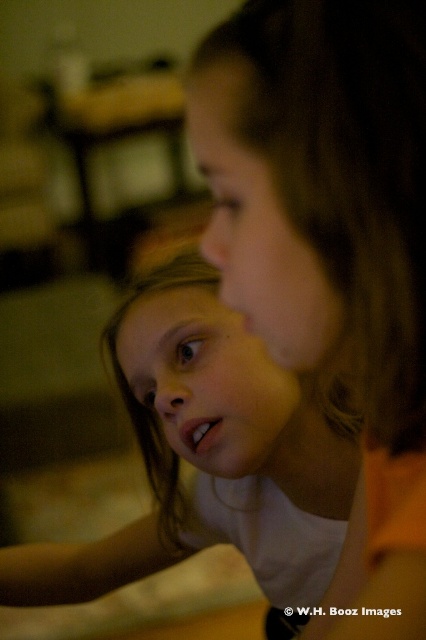
You are a photographer who wants to adjust the focus to capture the matte orange shirt at center clearly. What are the coordinates where you should focus your camera?

The coordinates to focus on are at point [331,250] to capture the matte orange shirt at center clearly.

You are a photographer who wants to ensure both the matte orange shirt at center and the smooth white shirt at center are clearly visible in the photo. Since the background is out of focus, which shirt should you adjust the camera focus on to ensure both shirts are in focus?

The matte orange shirt at center has a smaller size compared to smooth white shirt at center, so you should focus on the matte orange shirt at center to ensure both shirts are in focus.

You are a photographer trying to capture a close shot of two children talking. You have a camera with a 5 inch wide lens. Can you fit both the matte orange shirt at center and the smooth white shirt at center into your frame without moving the camera?

The matte orange shirt at center and smooth white shirt at center are 8.89 inches apart from each other. Since the lens is only 5 inches wide, it cannot cover the 8.89 inch distance between them. Therefore, you cannot fit both into the frame without moving the camera.